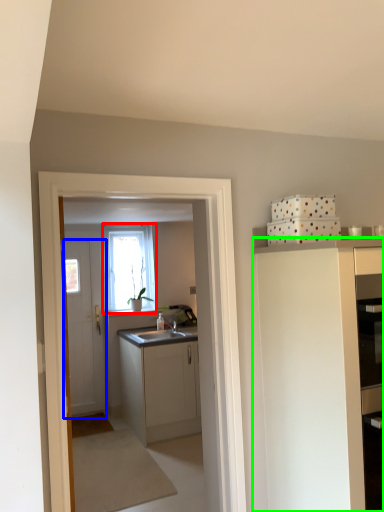
Question: Considering the real-world distances, which object is farthest from window (highlighted by a red box)? door (highlighted by a blue box) or cabinetry (highlighted by a green box)?

Choices:
 (A) door
 (B) cabinetry

Answer: (B)